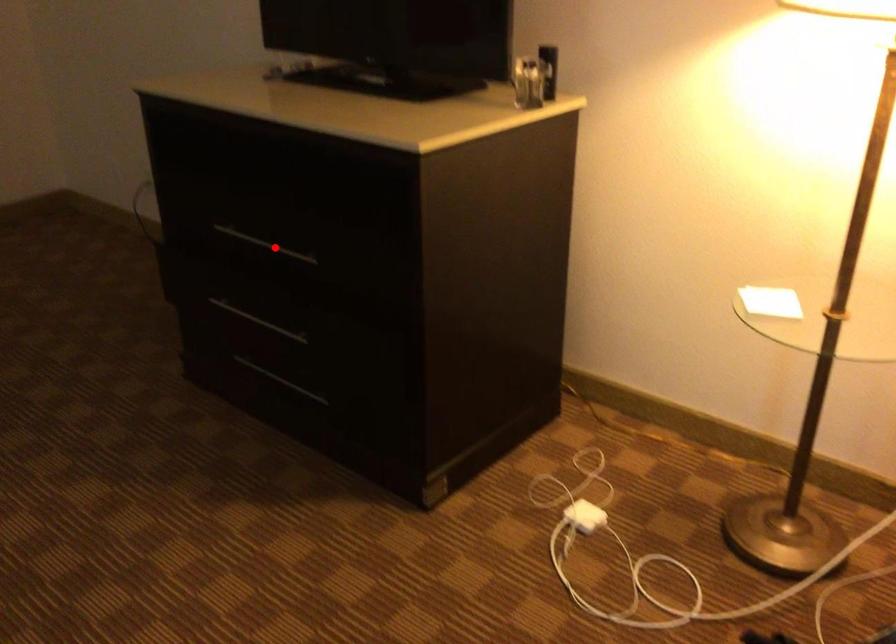
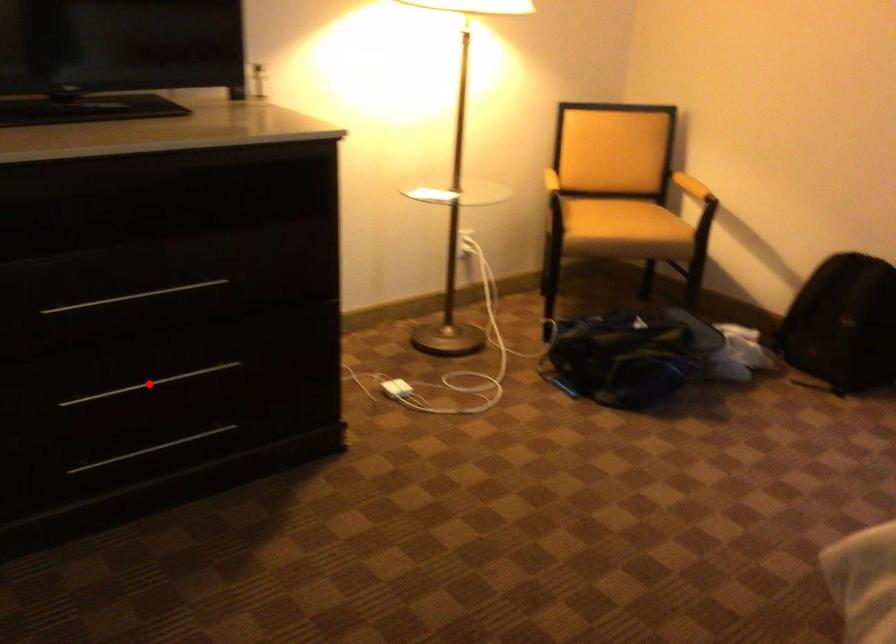
I am providing you with two images of the same scene from different viewpoints. A red point is marked on the first image and another point is marked on the second image. Is the red point in image1 aligned with the point shown in image2?

No